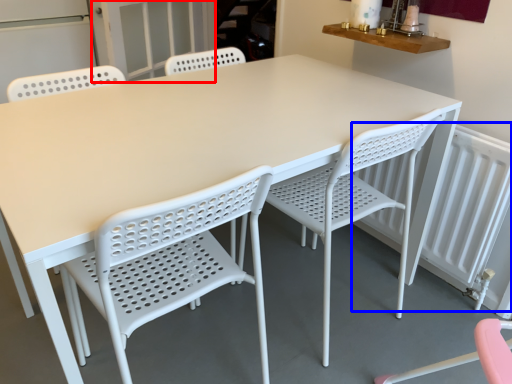
Question: Which point is further to the camera, screen door (highlighted by a red box) or radiator (highlighted by a blue box)?

Choices:
 (A) screen door
 (B) radiator

Answer: (A)